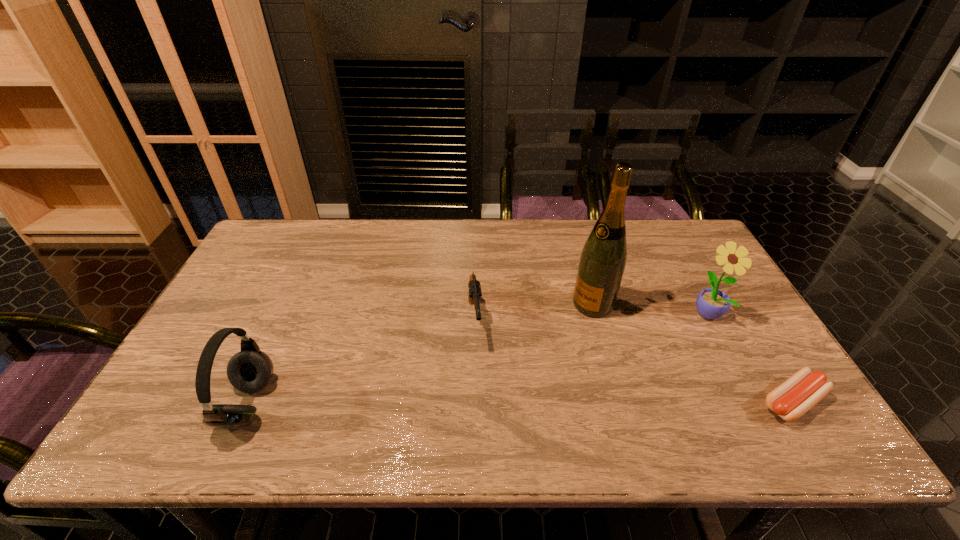
You are a GUI agent. You are given a task and a screenshot of the screen. Output one action in this format:
    pyautogui.click(x=<x>, y=<y>)
    Task: Click on the headset
    
    Given the screenshot: What is the action you would take?
    pyautogui.click(x=249, y=371)

Locate an element on the screen. the leftmost object is located at coordinates (249, 371).

You are a GUI agent. You are given a task and a screenshot of the screen. Output one action in this format:
    pyautogui.click(x=<x>, y=<y>)
    Task: Click on the sausage
    This screenshot has height=540, width=960.
    Given the screenshot: What is the action you would take?
    pyautogui.click(x=803, y=390)

Where is `sunflower`? sunflower is located at coordinates (711, 303).

Where is `wine bottle`? The height and width of the screenshot is (540, 960). wine bottle is located at coordinates (603, 258).

Where is `the third object from right to left`? the third object from right to left is located at coordinates (603, 258).

This screenshot has width=960, height=540. I want to click on gun, so click(475, 293).

This screenshot has height=540, width=960. Find the location of `the second object from left to right`. the second object from left to right is located at coordinates (475, 293).

This screenshot has height=540, width=960. I want to click on free location located on the ear cups of the leftmost object, so click(x=397, y=404).

The width and height of the screenshot is (960, 540). What are the coordinates of `free space located 0.250m on the left of the sausage` in the screenshot? It's located at (651, 402).